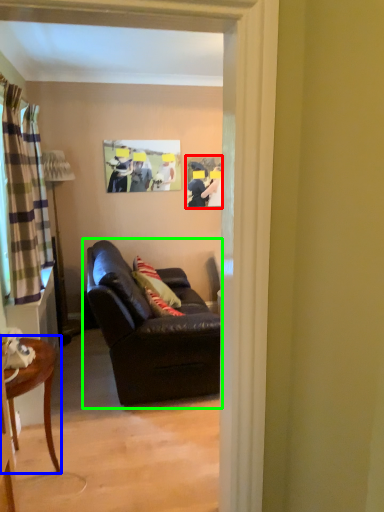
Question: Which is nearer to the picture frame (highlighted by a red box)? table (highlighted by a blue box) or studio couch (highlighted by a green box).

Choices:
 (A) table
 (B) studio couch

Answer: (B)